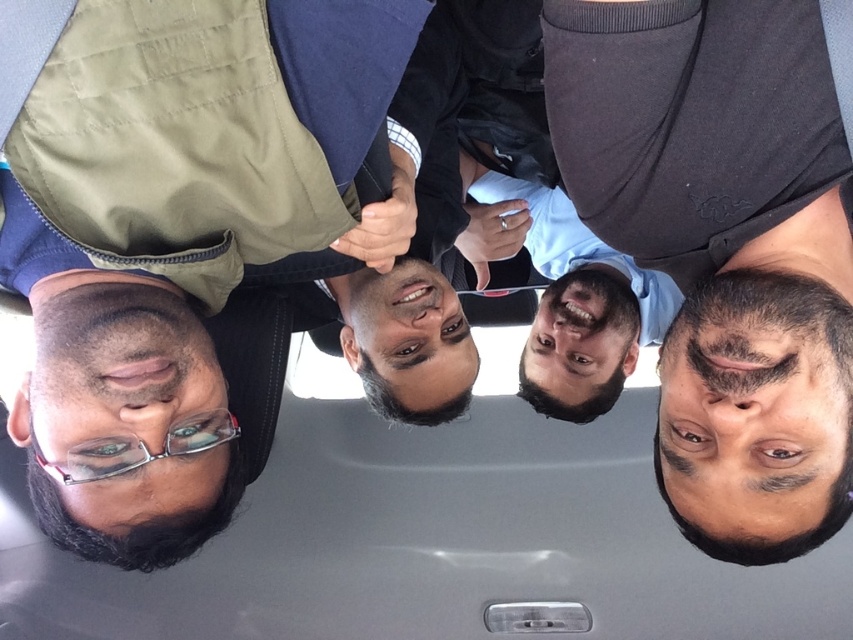
You are sitting in the vehicle and want to reach a snack bag placed at point (405,186) and a water bottle at point (480,282). Which item is closer to you?

The snack bag at point (405,186) is closer to you than the water bottle at point (480,282).

You are a delivery person who needs to place a 12 inch wide package between the dark gray matte shirt at upper right and the matte black hand at center. Can you fit it in the space between them?

The distance between the dark gray matte shirt at upper right and the matte black hand at center is 13.00 inches, so the 12 inch wide package can fit in the space between them since it is narrower than the available space.

You are trying to take a photo of the dark gray matte shirt at upper right and the matte black phone at center. Which object is taller in the image?

The dark gray matte shirt at upper right is taller than the matte black phone at center according to the description.